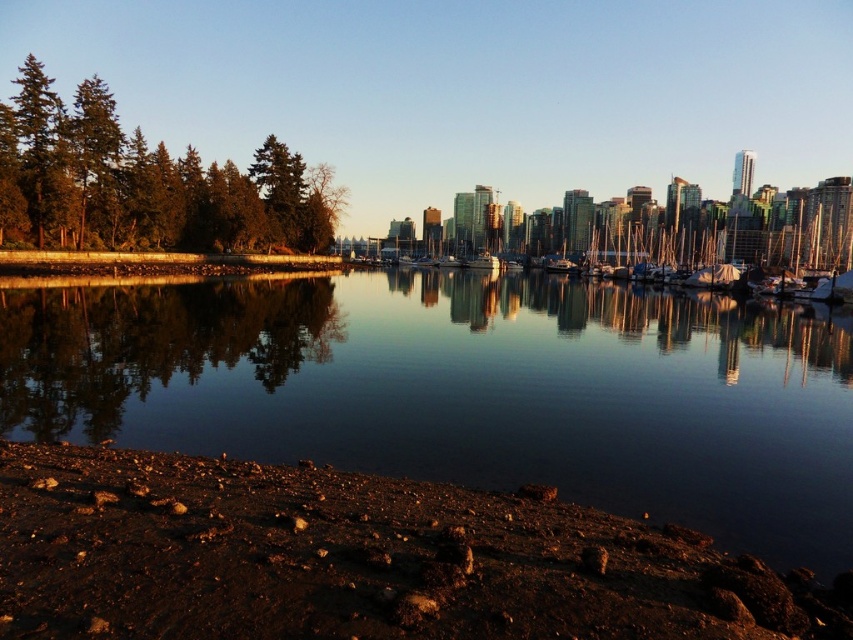
Question: Observing the image, what is the correct spatial positioning of dull brown dirt at lower left in reference to white glossy boat at center?

Choices:
 (A) above
 (B) below

Answer: (B)

Question: Which point is farther to the camera?

Choices:
 (A) green matte trees at left
 (B) white glossy boat at center
 (C) smooth reflective water at center
 (D) dull brown dirt at lower left

Answer: (B)

Question: Does dull brown dirt at lower left appear on the left side of white glossy boat at center?

Choices:
 (A) yes
 (B) no

Answer: (A)

Question: Which point is closer to the camera?

Choices:
 (A) (257, 381)
 (B) (483, 259)
 (C) (132, 458)
 (D) (103, 108)

Answer: (C)

Question: From the image, what is the correct spatial relationship of dull brown dirt at lower left in relation to white glossy boat at center?

Choices:
 (A) below
 (B) above

Answer: (A)

Question: Among these points, which one is nearest to the camera?

Choices:
 (A) (560, 532)
 (B) (495, 269)
 (C) (561, 387)

Answer: (A)